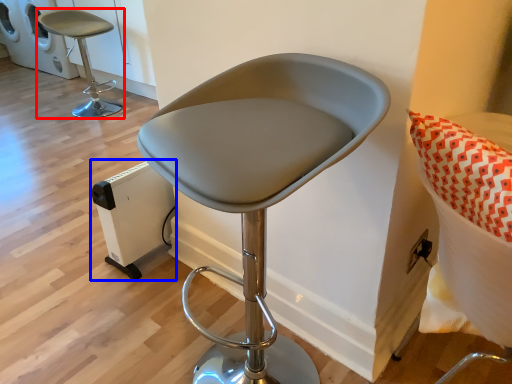
Question: Which object appears farthest to the camera in this image, chair (highlighted by a red box) or appliance (highlighted by a blue box)?

Choices:
 (A) chair
 (B) appliance

Answer: (A)